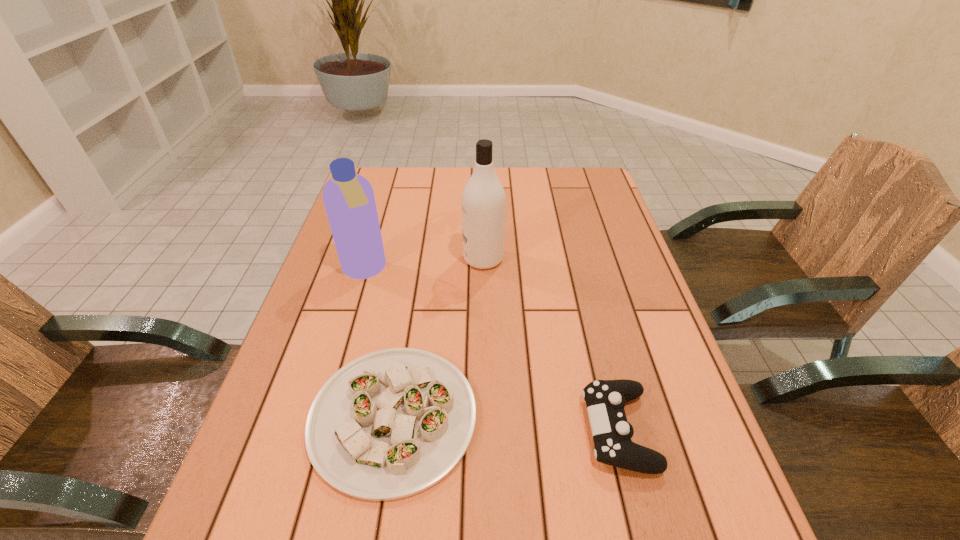
In order to click on the right shampoo in this screenshot , I will do `click(483, 199)`.

This screenshot has width=960, height=540. I want to click on the left shampoo, so pyautogui.click(x=348, y=197).

Locate an element on the screen. control is located at coordinates (605, 399).

Where is `the rightmost object`? This screenshot has width=960, height=540. the rightmost object is located at coordinates (605, 399).

Locate an element on the screen. platter is located at coordinates (390, 424).

The width and height of the screenshot is (960, 540). I want to click on vacant space located on the front-facing side of the right shampoo, so click(x=401, y=259).

Where is `free space located 0.120m on the front-facing side of the right shampoo`? free space located 0.120m on the front-facing side of the right shampoo is located at coordinates click(x=420, y=259).

Find the location of a particular element. The width and height of the screenshot is (960, 540). free space located 0.240m on the front-facing side of the right shampoo is located at coordinates (375, 259).

Locate an element on the screen. The width and height of the screenshot is (960, 540). free space located on the back of the left shampoo is located at coordinates (383, 206).

The height and width of the screenshot is (540, 960). I want to click on blank area located on the surface of the third tallest object, so click(x=533, y=429).